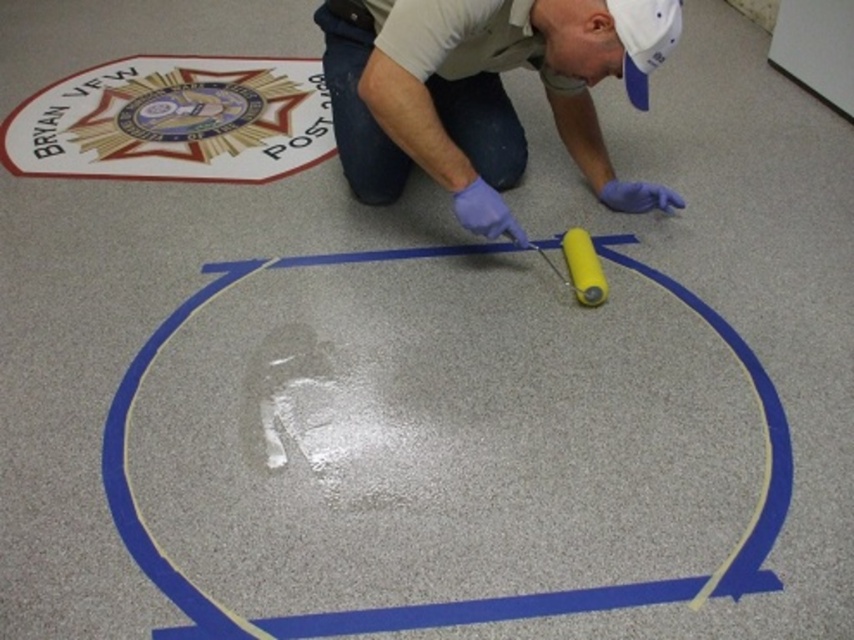
Question: Does purple-latex-gloved-man at center appear on the right side of blue glossy tape at center?

Choices:
 (A) no
 (B) yes

Answer: (B)

Question: Which point appears farthest from the camera in this image?

Choices:
 (A) (531, 40)
 (B) (472, 605)

Answer: (A)

Question: Does purple-latex-gloved-man at center come in front of blue glossy tape at center?

Choices:
 (A) yes
 (B) no

Answer: (B)

Question: Can you confirm if purple-latex-gloved-man at center is positioned to the left of blue glossy tape at center?

Choices:
 (A) no
 (B) yes

Answer: (A)

Question: Which of the following is the closest to the observer?

Choices:
 (A) pyautogui.click(x=613, y=257)
 (B) pyautogui.click(x=399, y=42)

Answer: (B)

Question: Which object appears closest to the camera in this image?

Choices:
 (A) purple-latex-gloved-man at center
 (B) blue glossy tape at center

Answer: (B)